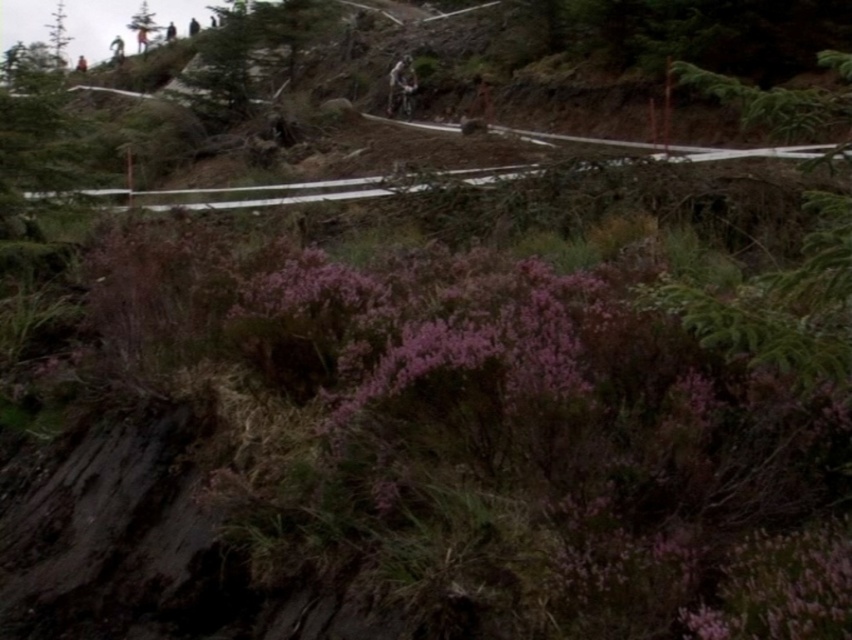
Question: Is green leafy tree at upper left to the left of shiny metallic mountain bike at center from the viewer's perspective?

Choices:
 (A) no
 (B) yes

Answer: (B)

Question: Which object appears closest to the camera in this image?

Choices:
 (A) green leafy tree at upper right
 (B) shiny metallic mountain bike at center
 (C) green matte tree at upper left

Answer: (A)

Question: Which object is closer to the camera taking this photo?

Choices:
 (A) green leafy tree at upper right
 (B) shiny metallic mountain bike at center
 (C) green matte tree at upper left
 (D) green leafy tree at upper left

Answer: (A)

Question: Is green leafy tree at upper left above green matte tree at upper left?

Choices:
 (A) no
 (B) yes

Answer: (B)

Question: Observing the image, what is the correct spatial positioning of green leafy tree at upper right in reference to green leafy tree at upper left?

Choices:
 (A) left
 (B) right

Answer: (B)

Question: Which object is positioned closest to the shiny metallic mountain bike at center?

Choices:
 (A) green matte tree at upper left
 (B) green leafy tree at upper right

Answer: (B)